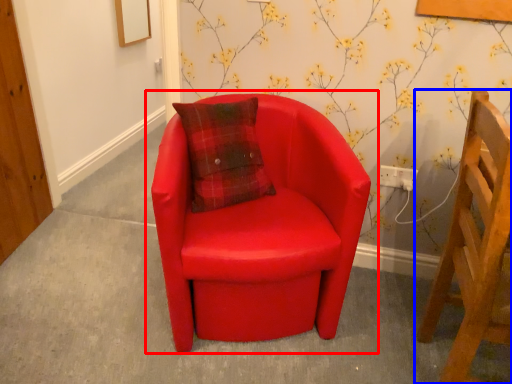
Question: Which point is closer to the camera, chair (highlighted by a red box) or chair (highlighted by a blue box)?

Choices:
 (A) chair
 (B) chair

Answer: (B)